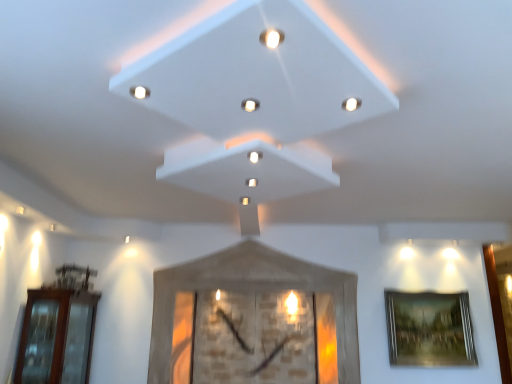
Question: In the image, is brown glass door at left positioned in front of or behind matte white light at upper right, acting as the 2th light starting from the front?

Choices:
 (A) behind
 (B) front

Answer: (A)

Question: From their relative heights in the image, would you say brown glass door at left is taller or shorter than matte white light at upper right, which is the 3th light in back-to-front order?

Choices:
 (A) tall
 (B) short

Answer: (A)

Question: Based on their relative distances, which object is farther from the white glossy light at center, the 3th light viewed from the front?

Choices:
 (A) gold-framed painting at right
 (B) white glossy light at upper center, which ranks as the 1th light in left-to-right order
 (C) brown glass door at left
 (D) matte white light at upper right, which is the 3th light in back-to-front order
 (E) white matte exhaust hood at center

Answer: (A)

Question: Which is farther from the white matte exhaust hood at center?

Choices:
 (A) white glossy light at center, acting as the 2th light starting from the right
 (B) white glossy light at upper center, the first light in the front-to-back sequence
 (C) brown glass door at left
 (D) white glossy light at center, which is counted as the 1th light, starting from the back
 (E) gold-framed painting at right

Answer: (E)